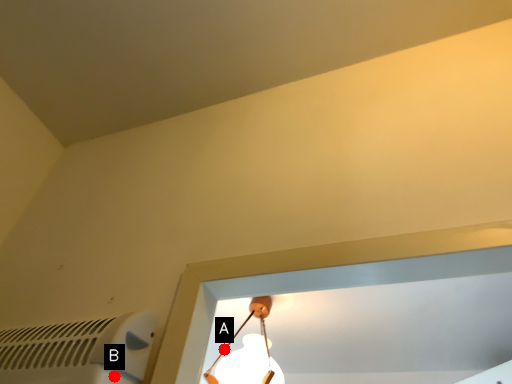
Question: Two points are circled on the image, labeled by A and B beside each circle. Which point is farther from the camera taking this photo?

Choices:
 (A) A is further
 (B) B is further

Answer: (A)